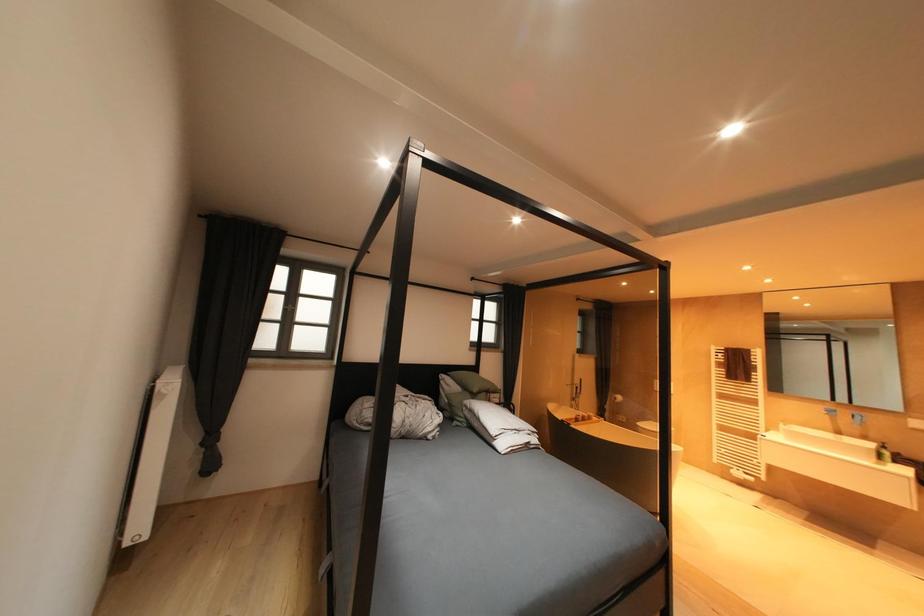
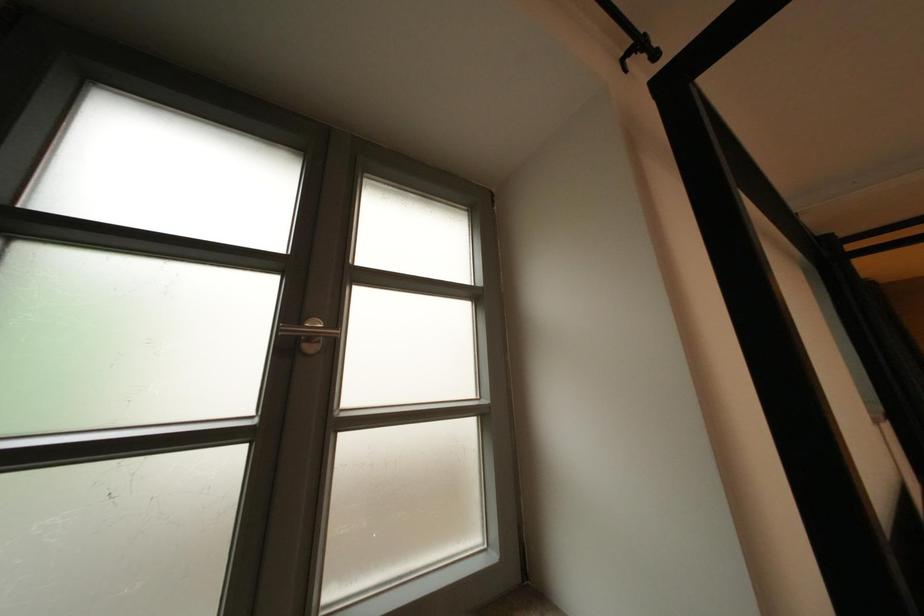
What movement of the cameraman would produce the second image?

The movement direction of the cameraman is left, forward.